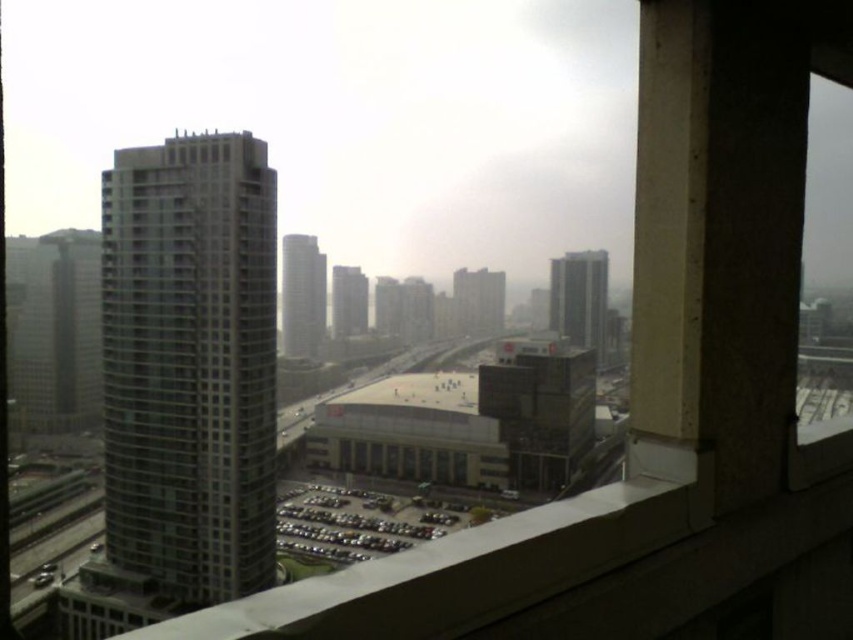
Question: Among these objects, which one is nearest to the camera?

Choices:
 (A) glassy reflective building at center
 (B) gray glass skyscraper at center

Answer: (A)

Question: Which object is positioned closest to the glassy gray tower at left?

Choices:
 (A) glassy reflective skyscraper at center
 (B) gray glass skyscraper at center
 (C) matte glass building at center

Answer: (B)

Question: Is glassy gray tower at left wider than gray glass skyscraper at center?

Choices:
 (A) yes
 (B) no

Answer: (A)

Question: Does matte glass building at center have a lesser width compared to glassy reflective skyscraper at center?

Choices:
 (A) yes
 (B) no

Answer: (B)

Question: Estimate the real-world distances between objects in this image. Which object is closer to the matte glass building at center?

Choices:
 (A) gray glass skyscraper at center
 (B) glassy reflective skyscraper at center

Answer: (B)

Question: Where is glassy reflective building at center located in relation to glassy reflective skyscraper at center in the image?

Choices:
 (A) above
 (B) below

Answer: (A)